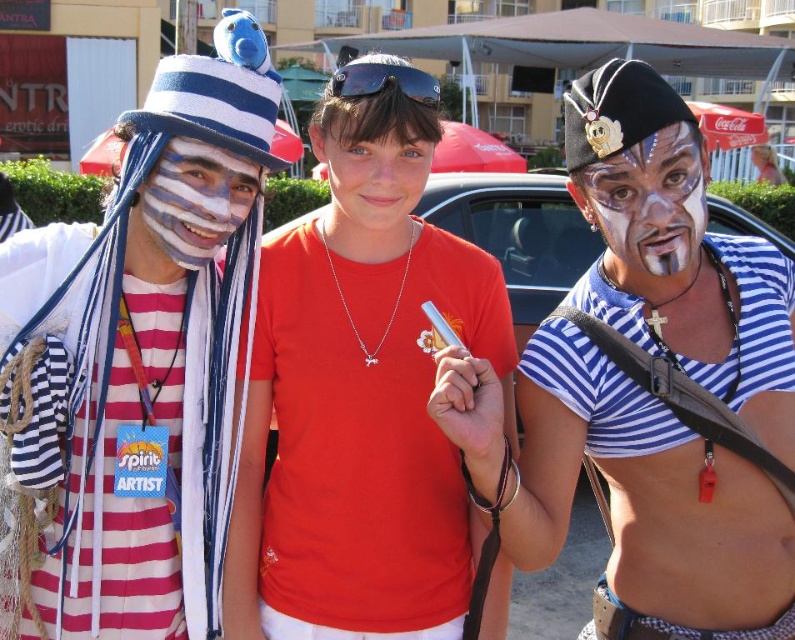
Question: Which point appears farthest from the camera in this image?

Choices:
 (A) (685, 152)
 (B) (379, 90)
 (C) (281, 493)

Answer: (C)

Question: Can you confirm if matte black pirate hat at center is positioned below black rubber goggles at center?

Choices:
 (A) yes
 (B) no

Answer: (A)

Question: Which object appears farthest from the camera in this image?

Choices:
 (A) red matte shirt at center
 (B) black rubber goggles at center

Answer: (A)

Question: Which object is positioned farthest from the matte striped face at center?

Choices:
 (A) black rubber goggles at center
 (B) matte red shirt at center
 (C) matte white face paint at center

Answer: (C)

Question: From the image, what is the correct spatial relationship of matte white face paint at center in relation to black rubber goggles at center?

Choices:
 (A) below
 (B) above

Answer: (A)

Question: Is matte black pirate hat at center smaller than matte red shirt at center?

Choices:
 (A) yes
 (B) no

Answer: (B)